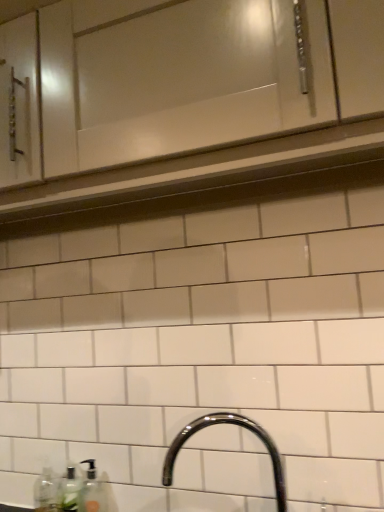
Question: In the image, is translucent plastic soap dispenser at lower left on the left side or the right side of clear plastic bottle at lower left, the 2th bottle positioned from the right?

Choices:
 (A) left
 (B) right

Answer: (B)

Question: Looking at their shapes, would you say translucent plastic soap dispenser at lower left is wider or thinner than clear plastic bottle at lower left, which appears as the first bottle when viewed from the left?

Choices:
 (A) wide
 (B) thin

Answer: (A)

Question: Based on their relative distances, which object is nearer to the translucent plastic soap dispenser at lower left?

Choices:
 (A) clear glass soap dispenser at lower left, the first bottle in the right-to-left sequence
 (B) clear plastic bottle at lower left, the 2th bottle positioned from the right
 (C) glossy chrome faucet at lower center
 (D) white glossy cabinet at upper center

Answer: (A)

Question: Which of these objects is positioned farthest from the clear glass soap dispenser at lower left, the second bottle viewed from the left?

Choices:
 (A) translucent plastic soap dispenser at lower left
 (B) glossy chrome faucet at lower center
 (C) clear plastic bottle at lower left, which appears as the first bottle when viewed from the left
 (D) white glossy cabinet at upper center

Answer: (D)